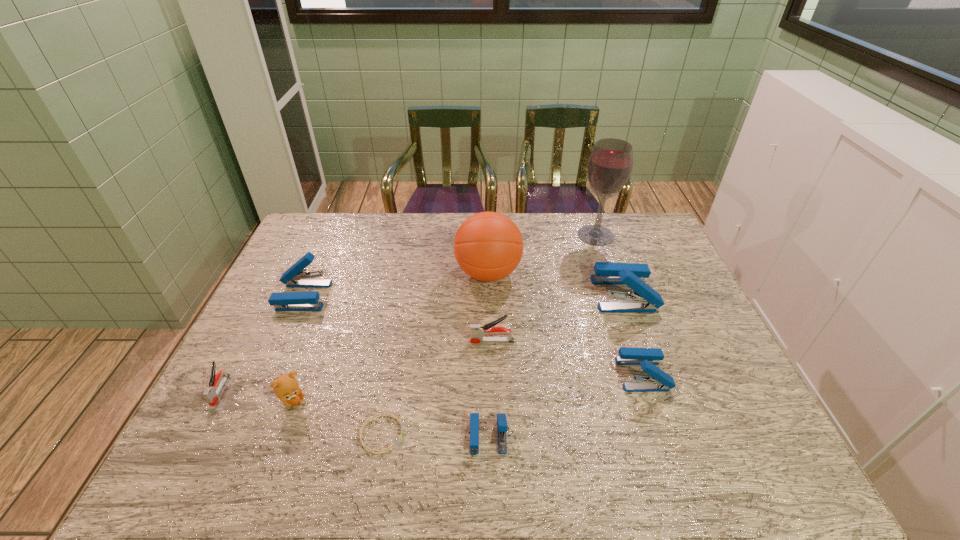
At what (x,y) coordinates should I click in order to perform the action: click on brown teddy bear. Please return your answer as a coordinate pair (x, y). The height and width of the screenshot is (540, 960). Looking at the image, I should click on (286, 388).

Locate an element on the screen. Image resolution: width=960 pixels, height=540 pixels. the third farthest blue stapler is located at coordinates (660, 381).

What are the coordinates of `the nearer gray stapler` in the screenshot? It's located at (211, 396).

The image size is (960, 540). Identify the location of the smaller gray stapler. (211, 396).

Identify the location of the second blue stapler from left to right. Image resolution: width=960 pixels, height=540 pixels. (502, 427).

Find the location of `the smallest blue stapler`. the smallest blue stapler is located at coordinates (502, 427).

Locate an element on the screen. This screenshot has width=960, height=540. bracelet is located at coordinates (381, 414).

Find the location of a particular element. Image resolution: width=960 pixels, height=540 pixels. the shortest object is located at coordinates (381, 414).

The height and width of the screenshot is (540, 960). I want to click on blank space located 0.080m on the left of the farthest object, so click(x=554, y=235).

Image resolution: width=960 pixels, height=540 pixels. What are the coordinates of `vacant area situated 0.080m on the left of the orange basketball` in the screenshot? It's located at (430, 273).